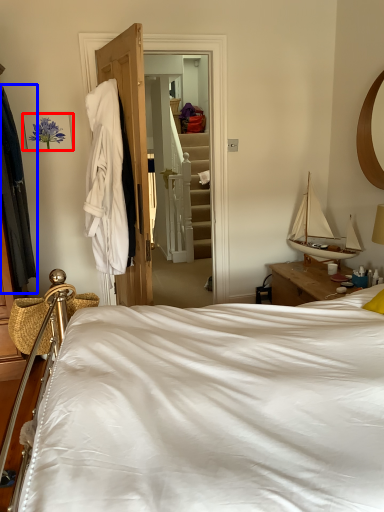
Question: Which object is further to the camera taking this photo, picture frame (highlighted by a red box) or clothing (highlighted by a blue box)?

Choices:
 (A) picture frame
 (B) clothing

Answer: (A)